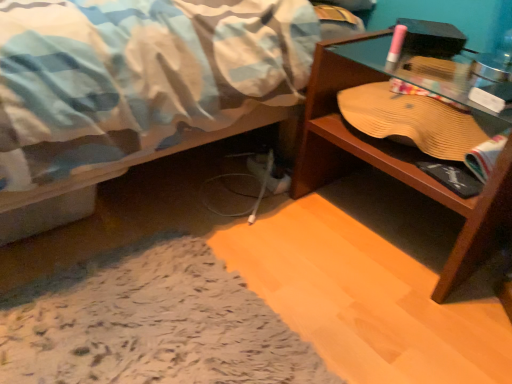
The height and width of the screenshot is (384, 512). I want to click on vacant point to the left of wooden desk at right, so click(251, 218).